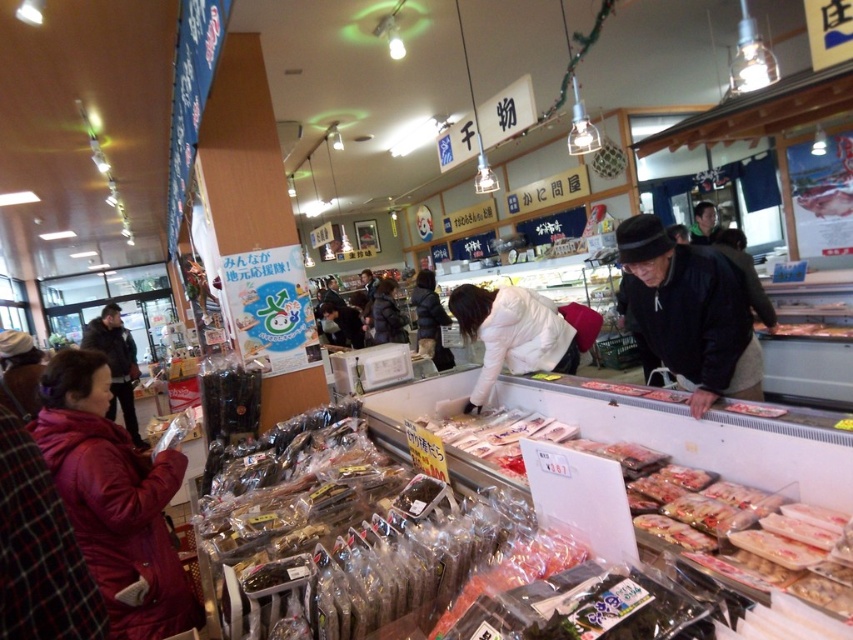
Based on the photo, is maroon synthetic coat at lower left further to camera compared to black matte jacket at center?

No, maroon synthetic coat at lower left is closer to the viewer.

Between maroon synthetic coat at lower left and black matte jacket at center, which one appears on the left side from the viewer's perspective?

maroon synthetic coat at lower left is more to the left.

Find the location of a particular element. The width and height of the screenshot is (853, 640). maroon synthetic coat at lower left is located at coordinates (114, 499).

Does translucent plastic seaweed at center have a larger size compared to dark blue jacket at center?

Yes, translucent plastic seaweed at center is bigger than dark blue jacket at center.

At what (x,y) coordinates should I click in order to perform the action: click on translucent plastic seaweed at center. Please return your answer as a coordinate pair (x, y). Looking at the image, I should click on (303, 448).

Does white matte jacket at center have a lesser width compared to dark blue jacket at center?

No, white matte jacket at center is not thinner than dark blue jacket at center.

Who is positioned more to the right, white matte jacket at center or dark blue jacket at center?

white matte jacket at center

Describe the element at coordinates (512, 333) in the screenshot. I see `white matte jacket at center` at that location.

The height and width of the screenshot is (640, 853). What are the coordinates of `white matte jacket at center` in the screenshot? It's located at (512, 333).